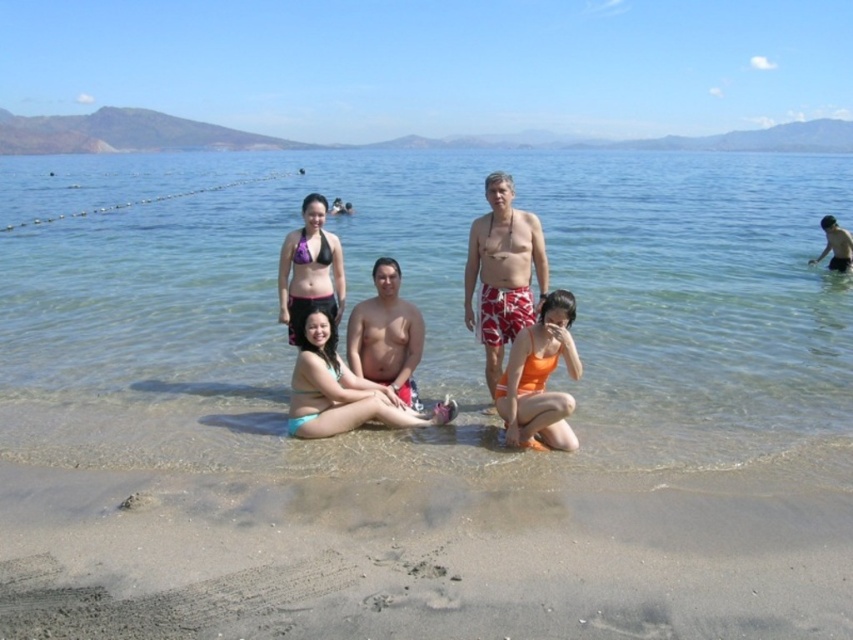
You are standing on the beach and want to walk from point A to point B. Point A is at coordinates point (321, 356) and point B is at coordinates point (525, 404). Which point is closer to you when you start walking?

Point A at coordinates point (321, 356) is closer to you than point B at coordinates point (525, 404) because it is further to the viewer.

You are a photographer trying to capture the entire group of six people in one shot. You notice the sandy beach at lower center and the teal bikini bottom at center. Based on their positions, which object should you focus on first to ensure all subjects are in frame?

The sandy beach at lower center is to the right of the teal bikini bottom at center, so focusing on the teal bikini bottom at center first will help ensure the entire group is captured in the frame since it is positioned more to the left.